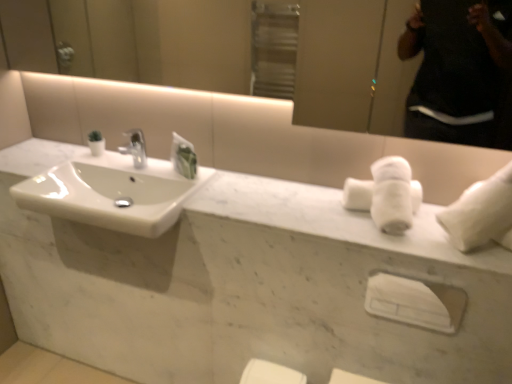
This screenshot has height=384, width=512. Identify the location of white marble counter top at center. (245, 286).

This screenshot has width=512, height=384. Describe the element at coordinates (111, 192) in the screenshot. I see `white glossy sink at left` at that location.

In order to click on white fluffy bath towel at upper right, marked as the 2th bath towel in a right-to-left arrangement in this screenshot , I will do `click(386, 195)`.

Is white marble counter top at center positioned far away from white glossy sink at left?

That's not correct — white marble counter top at center is a little close to white glossy sink at left.

In the image, there is a white marble counter top at center. Identify the location of sink below it (from a real-world perspective). (111, 192).

Does white marble counter top at center have a smaller size compared to white glossy sink at left?

Yes, white marble counter top at center is smaller than white glossy sink at left.

Is white marble counter top at center taller than white glossy sink at left?

No, white marble counter top at center is not taller than white glossy sink at left.

Looking at the image, does white fluffy bath towel at upper right, the 1th bath towel viewed from the left, seem bigger or smaller compared to white glossy sink at left?

Considering their sizes, white fluffy bath towel at upper right, the 1th bath towel viewed from the left, takes up less space than white glossy sink at left.

Which is correct: white fluffy bath towel at upper right, the 1th bath towel viewed from the left, is inside white glossy sink at left, or outside of it?

white fluffy bath towel at upper right, the 1th bath towel viewed from the left, is outside white glossy sink at left.

Can you confirm if white fluffy bath towel at upper right, marked as the 2th bath towel in a right-to-left arrangement, is wider than white glossy sink at left?

Incorrect, the width of white fluffy bath towel at upper right, marked as the 2th bath towel in a right-to-left arrangement, does not surpass that of white glossy sink at left.

Is white fluffy bath towel at upper right, the 1th bath towel viewed from the left, beside white glossy sink at left?

No, white fluffy bath towel at upper right, the 1th bath towel viewed from the left, is not next to white glossy sink at left.

The width and height of the screenshot is (512, 384). I want to click on sink that appears above the white matte towel at right, the 1th bath towel when ordered from right to left (from the image's perspective), so click(x=111, y=192).

Is white glossy sink at left positioned with its back to white matte towel at right, which is the second bath towel in left-to-right order?

No, white matte towel at right, which is the second bath towel in left-to-right order, is not at the back of white glossy sink at left.

Between white glossy sink at left and white matte towel at right, the 1th bath towel when ordered from right to left, which one has smaller size?

With smaller size is white matte towel at right, the 1th bath towel when ordered from right to left.

Is white glossy sink at left not near white matte towel at right, which is the second bath towel in left-to-right order?

No.

Is white matte towel at right, the 1th bath towel when ordered from right to left, positioned far away from white glossy sink at left?

No, white matte towel at right, the 1th bath towel when ordered from right to left, is not far from white glossy sink at left.

How different are the orientations of white matte towel at right, the 1th bath towel when ordered from right to left, and white glossy sink at left in degrees?

0.000463 degrees.

Does white matte towel at right, which is the second bath towel in left-to-right order, have a lesser height compared to white glossy sink at left?

Incorrect, the height of white matte towel at right, which is the second bath towel in left-to-right order, does not fall short of that of white glossy sink at left.

From the image's perspective, is white matte towel at right, which is the second bath towel in left-to-right order, located beneath white glossy sink at left?

Correct, white matte towel at right, which is the second bath towel in left-to-right order, appears lower than white glossy sink at left in the image.

Consider the image. Who is bigger, white fluffy bath towel at upper right, marked as the 2th bath towel in a right-to-left arrangement, or white matte towel at right, the 1th bath towel when ordered from right to left?

Bigger between the two is white matte towel at right, the 1th bath towel when ordered from right to left.

Is white fluffy bath towel at upper right, marked as the 2th bath towel in a right-to-left arrangement, next to white matte towel at right, which is the second bath towel in left-to-right order, and touching it?

No, white fluffy bath towel at upper right, marked as the 2th bath towel in a right-to-left arrangement, is not with white matte towel at right, which is the second bath towel in left-to-right order.

This screenshot has height=384, width=512. I want to click on bath towel below the white fluffy bath towel at upper right, the 1th bath towel viewed from the left (from the image's perspective), so click(481, 212).

Is white marble counter top at center completely or partially inside white plastic towel bar at center?

No, white marble counter top at center is not a part of white plastic towel bar at center.

Considering the sizes of objects white plastic towel bar at center and white marble counter top at center in the image provided, who is taller, white plastic towel bar at center or white marble counter top at center?

Standing taller between the two is white plastic towel bar at center.

Does white plastic towel bar at center have a greater width compared to white marble counter top at center?

Incorrect, the width of white plastic towel bar at center does not surpass that of white marble counter top at center.

Is the depth of white plastic towel bar at center less than that of white marble counter top at center?

No, the depth of white plastic towel bar at center is greater than that of white marble counter top at center.

Is white fluffy bath towel at upper right, the 1th bath towel viewed from the left, taller than white plastic towel bar at center?

Indeed, white fluffy bath towel at upper right, the 1th bath towel viewed from the left, has a greater height compared to white plastic towel bar at center.

Is white fluffy bath towel at upper right, the 1th bath towel viewed from the left, facing towards white plastic towel bar at center?

No.

In the scene shown: Can you tell me how much white fluffy bath towel at upper right, marked as the 2th bath towel in a right-to-left arrangement, and white plastic towel bar at center differ in facing direction?

The angular difference between white fluffy bath towel at upper right, marked as the 2th bath towel in a right-to-left arrangement, and white plastic towel bar at center is 0.0198 degrees.

Looking at this image, from the image's perspective, would you say white fluffy bath towel at upper right, the 1th bath towel viewed from the left, is shown under white plastic towel bar at center?

Incorrect, from the image's perspective, white fluffy bath towel at upper right, the 1th bath towel viewed from the left, is higher than white plastic towel bar at center.

The height and width of the screenshot is (384, 512). In order to click on counter top on the right of white glossy sink at left in this screenshot , I will do `click(245, 286)`.

Locate an element on the screen. the 1st bath towel in front when counting from the white glossy sink at left is located at coordinates (386, 195).

From the image, which object appears to be farther from white plastic towel bar at center, white marble counter top at center or white fluffy bath towel at upper right, the 1th bath towel viewed from the left?

white marble counter top at center is positioned further to the anchor white plastic towel bar at center.

Looking at the image, which one is located closer to white fluffy bath towel at upper right, marked as the 2th bath towel in a right-to-left arrangement, white glossy sink at left or white marble counter top at center?

white marble counter top at center lies closer to white fluffy bath towel at upper right, marked as the 2th bath towel in a right-to-left arrangement, than the other object.

Estimate the real-world distances between objects in this image. Which object is closer to white marble counter top at center, white plastic towel bar at center or white fluffy bath towel at upper right, marked as the 2th bath towel in a right-to-left arrangement?

Based on the image, white fluffy bath towel at upper right, marked as the 2th bath towel in a right-to-left arrangement, appears to be nearer to white marble counter top at center.

Looking at the image, which one is located further to white marble counter top at center, white matte towel at right, the 1th bath towel when ordered from right to left, or white fluffy bath towel at upper right, marked as the 2th bath towel in a right-to-left arrangement?

white matte towel at right, the 1th bath towel when ordered from right to left, is positioned further to the anchor white marble counter top at center.

In the scene shown: Which object lies nearer to the anchor point white matte towel at right, which is the second bath towel in left-to-right order, white marble counter top at center or white fluffy bath towel at upper right, marked as the 2th bath towel in a right-to-left arrangement?

white fluffy bath towel at upper right, marked as the 2th bath towel in a right-to-left arrangement, is positioned closer to the anchor white matte towel at right, which is the second bath towel in left-to-right order.

Estimate the real-world distances between objects in this image. Which object is further from white fluffy bath towel at upper right, marked as the 2th bath towel in a right-to-left arrangement, white matte towel at right, the 1th bath towel when ordered from right to left, or white marble counter top at center?

Among the two, white marble counter top at center is located further to white fluffy bath towel at upper right, marked as the 2th bath towel in a right-to-left arrangement.

When comparing their distances from white glossy sink at left, does white marble counter top at center or white plastic towel bar at center seem further?

white plastic towel bar at center is further to white glossy sink at left.

Which object lies nearer to the anchor point white matte towel at right, which is the second bath towel in left-to-right order, white plastic towel bar at center or white marble counter top at center?

white plastic towel bar at center.

Identify the location of towel bar located between white marble counter top at center and white matte towel at right, which is the second bath towel in left-to-right order, in the left-right direction. (406, 302).

The width and height of the screenshot is (512, 384). Identify the location of counter top located between white glossy sink at left and white plastic towel bar at center in the left-right direction. (245, 286).

Where is `bath towel between white fluffy bath towel at upper right, the 1th bath towel viewed from the left, and white plastic towel bar at center from top to bottom`? bath towel between white fluffy bath towel at upper right, the 1th bath towel viewed from the left, and white plastic towel bar at center from top to bottom is located at coordinates (481, 212).

Image resolution: width=512 pixels, height=384 pixels. Find the location of `counter top situated between white glossy sink at left and white matte towel at right, which is the second bath towel in left-to-right order, from left to right`. counter top situated between white glossy sink at left and white matte towel at right, which is the second bath towel in left-to-right order, from left to right is located at coordinates (245, 286).